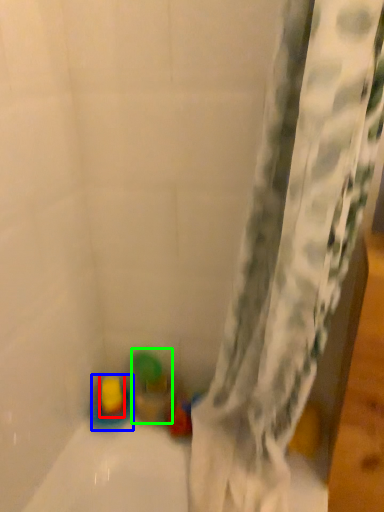
Question: Considering the real-world distances, which object is closest to toy (highlighted by a red box)? toy (highlighted by a blue box) or toy (highlighted by a green box).

Choices:
 (A) toy
 (B) toy

Answer: (A)